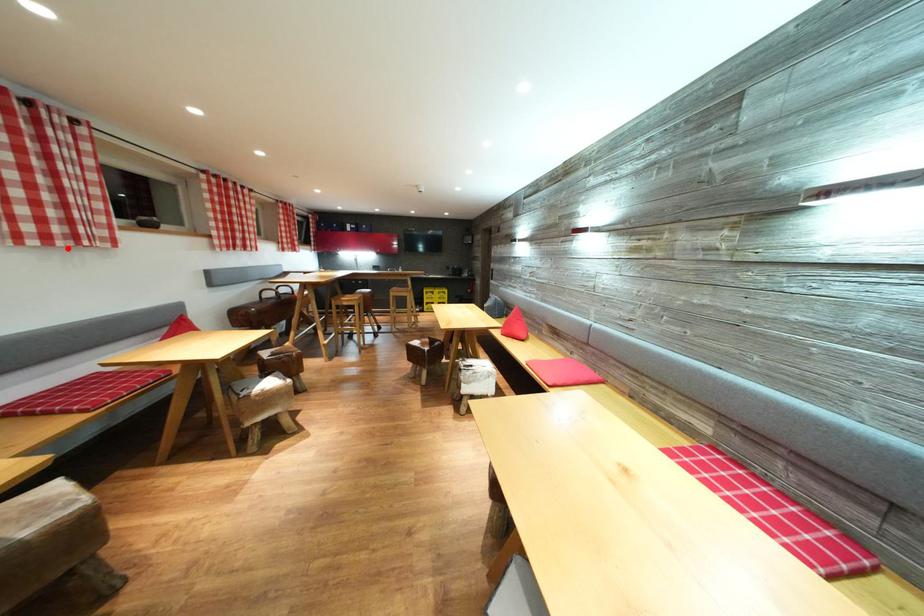
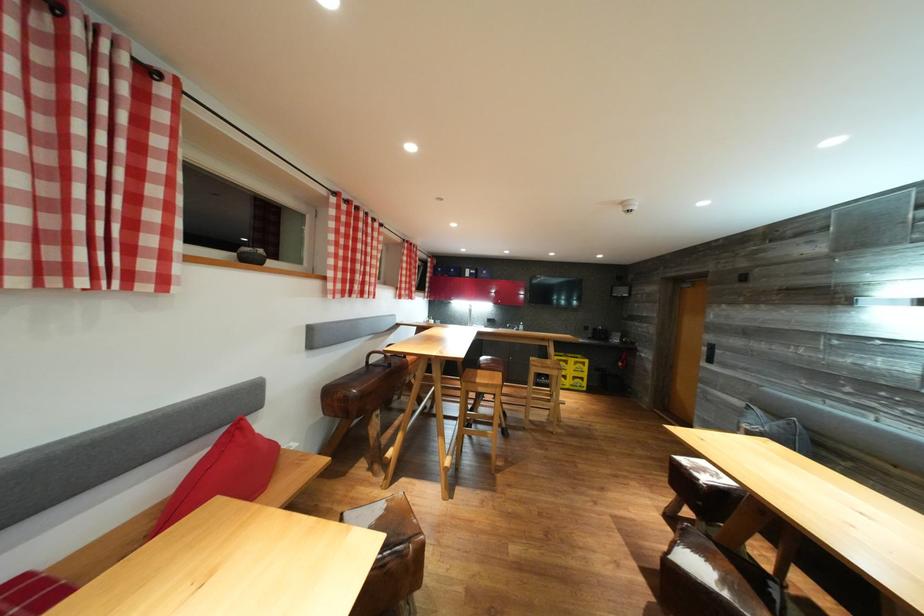
Find the pixel in the second image that matches the highlighted location in the first image.

(23, 286)